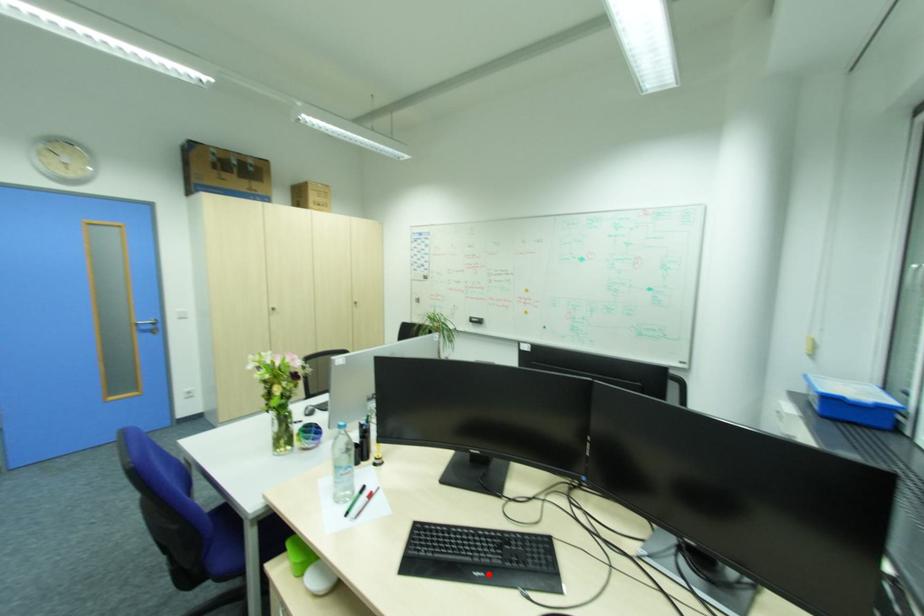
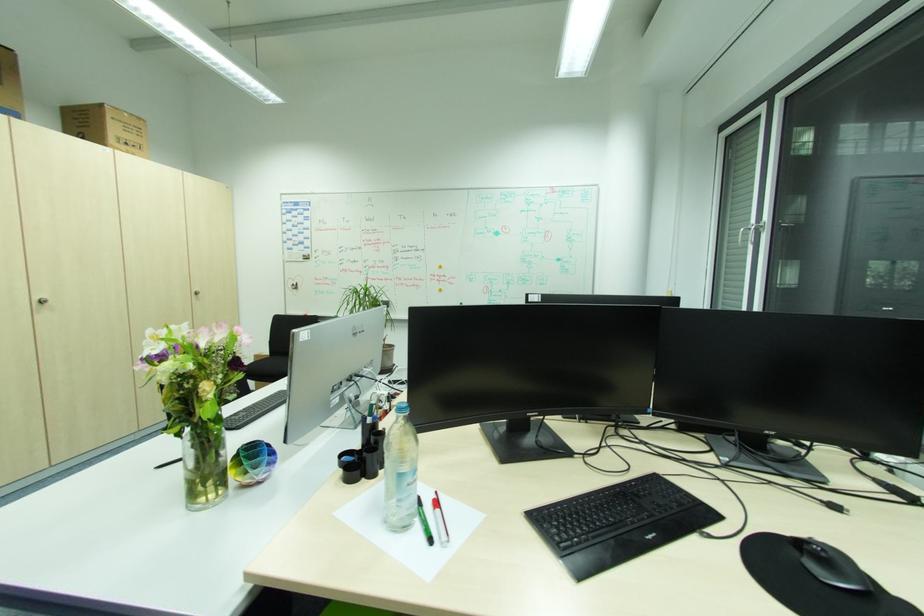
Where in the second image is the point corresponding to the highlighted location from the first image?

(660, 533)